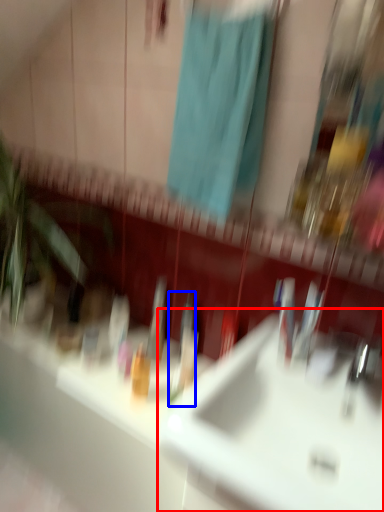
Question: Which of the following is the farthest to the observer, sink (highlighted by a red box) or toothbrush (highlighted by a blue box)?

Choices:
 (A) sink
 (B) toothbrush

Answer: (B)